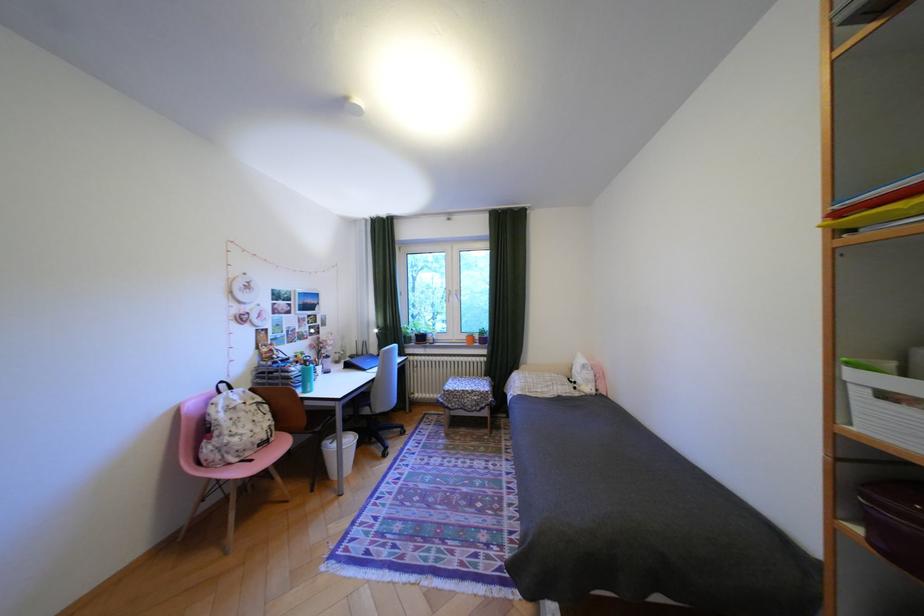
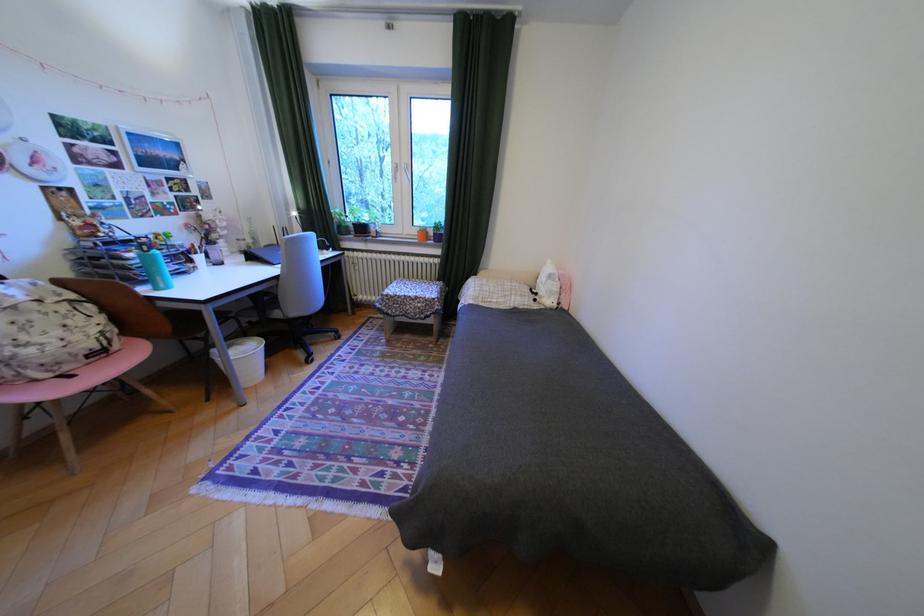
The point at (305, 369) is marked in the first image. Where is the corresponding point in the second image?

(140, 254)